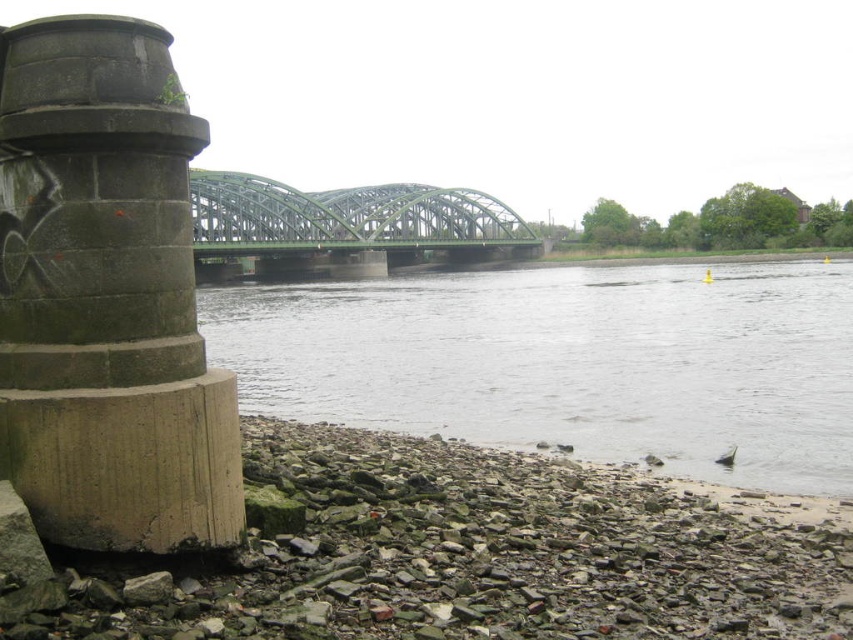
Question: Does gray gravel river at lower center have a larger size compared to concrete pillar at left?

Choices:
 (A) no
 (B) yes

Answer: (B)

Question: Among these points, which one is farthest from the camera?

Choices:
 (A) (422, 321)
 (B) (397, 236)
 (C) (178, 536)

Answer: (B)

Question: Is rough stone river bank at lower left bigger than concrete pillar at left?

Choices:
 (A) no
 (B) yes

Answer: (B)

Question: Which point is closer to the camera taking this photo?

Choices:
 (A) (804, 474)
 (B) (148, 420)
 (C) (347, 276)
 (D) (149, 572)

Answer: (B)

Question: Is the position of rough stone river bank at lower left less distant than that of gray gravel river at lower center?

Choices:
 (A) yes
 (B) no

Answer: (A)

Question: Which point is farther to the camera?

Choices:
 (A) green metallic bridge at center
 (B) rough stone river bank at lower left
 (C) gray gravel river at lower center

Answer: (C)